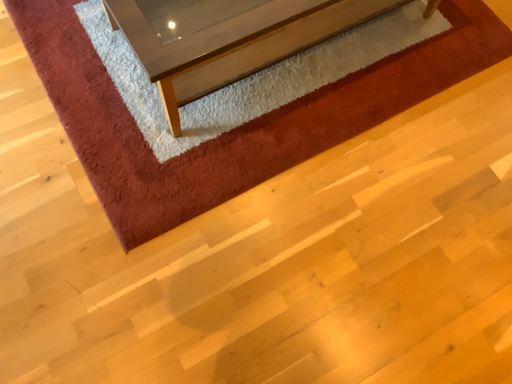
Question: Can you confirm if shaggy red carpet at upper center is shorter than clear glass coffee table at upper center?

Choices:
 (A) no
 (B) yes

Answer: (B)

Question: Is shaggy red carpet at upper center oriented towards clear glass coffee table at upper center?

Choices:
 (A) yes
 (B) no

Answer: (B)

Question: Does shaggy red carpet at upper center appear on the right side of clear glass coffee table at upper center?

Choices:
 (A) no
 (B) yes

Answer: (A)

Question: Is clear glass coffee table at upper center completely or partially inside shaggy red carpet at upper center?

Choices:
 (A) yes
 (B) no

Answer: (B)

Question: Are shaggy red carpet at upper center and clear glass coffee table at upper center located far from each other?

Choices:
 (A) no
 (B) yes

Answer: (A)

Question: From a real-world perspective, is shaggy red carpet at upper center under clear glass coffee table at upper center?

Choices:
 (A) yes
 (B) no

Answer: (A)

Question: Is clear glass coffee table at upper center turned away from shaggy red carpet at upper center?

Choices:
 (A) no
 (B) yes

Answer: (A)

Question: From the image's perspective, would you say clear glass coffee table at upper center is positioned over shaggy red carpet at upper center?

Choices:
 (A) no
 (B) yes

Answer: (B)

Question: Does clear glass coffee table at upper center have a smaller size compared to shaggy red carpet at upper center?

Choices:
 (A) no
 (B) yes

Answer: (A)

Question: From a real-world perspective, is clear glass coffee table at upper center over shaggy red carpet at upper center?

Choices:
 (A) no
 (B) yes

Answer: (B)

Question: Can you confirm if clear glass coffee table at upper center is bigger than shaggy red carpet at upper center?

Choices:
 (A) yes
 (B) no

Answer: (A)

Question: Is clear glass coffee table at upper center not within shaggy red carpet at upper center?

Choices:
 (A) yes
 (B) no

Answer: (A)

Question: From the image's perspective, relative to clear glass coffee table at upper center, is shaggy red carpet at upper center above or below?

Choices:
 (A) below
 (B) above

Answer: (A)